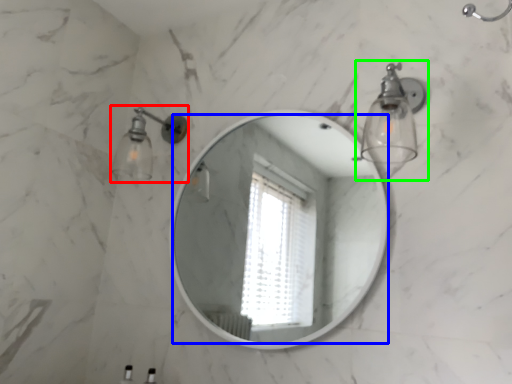
Question: Estimate the real-world distances between objects in this image. Which object is farther from light fixture (highlighted by a red box), mirror (highlighted by a blue box) or light fixture (highlighted by a green box)?

Choices:
 (A) mirror
 (B) light fixture

Answer: (A)